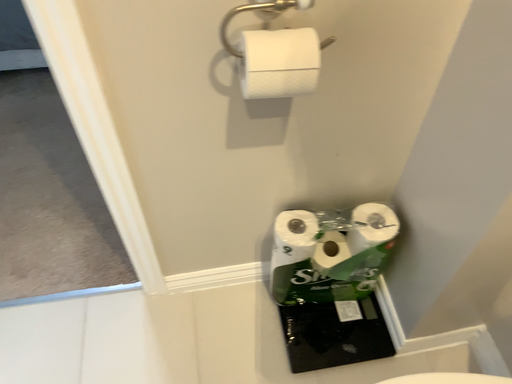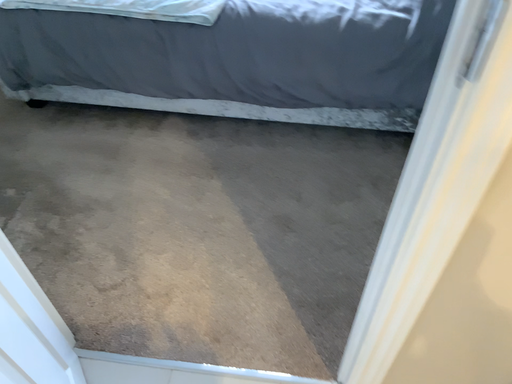
Question: How did the camera likely rotate when shooting the video?

Choices:
 (A) rotated right
 (B) rotated left

Answer: (B)